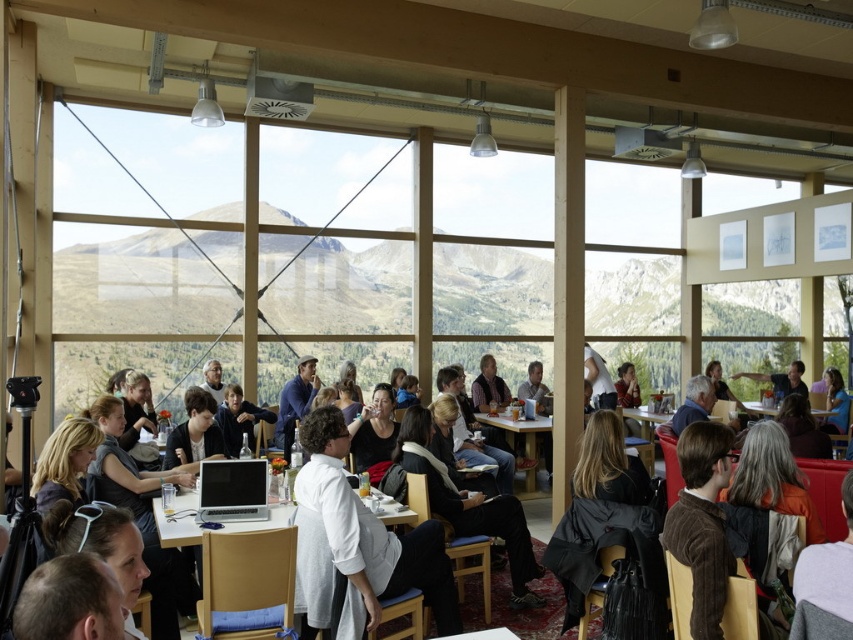
Question: Which point is closer to the camera?

Choices:
 (A) silver metallic laptop at center
 (B) white matte sweater at center
 (C) white shirt at center

Answer: (B)

Question: Which point is farther to the camera?

Choices:
 (A) (469, 589)
 (B) (517, 464)

Answer: (B)

Question: Where is wooden table at center located in relation to white plastic table at center in the image?

Choices:
 (A) left
 (B) right

Answer: (A)

Question: Can you confirm if silver metallic laptop at center is positioned to the right of dark brown leather jacket at lower right?

Choices:
 (A) no
 (B) yes

Answer: (A)

Question: Among these objects, which one is nearest to the camera?

Choices:
 (A) white matte sweater at center
 (B) wooden table at center
 (C) white shirt at center

Answer: (A)

Question: Does silver metallic laptop at center appear under white glossy table at center?

Choices:
 (A) no
 (B) yes

Answer: (B)